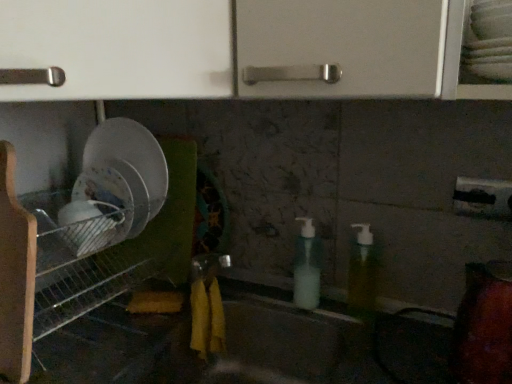
Question: Does translucent plastic soap dispenser at center, the second soap dispenser in the left-to-right sequence, have a smaller size compared to matte gray sink at center?

Choices:
 (A) yes
 (B) no

Answer: (A)

Question: Does translucent plastic soap dispenser at center, positioned as the first soap dispenser in right-to-left order, have a greater height compared to matte gray sink at center?

Choices:
 (A) yes
 (B) no

Answer: (B)

Question: From the image's perspective, is translucent plastic soap dispenser at center, positioned as the first soap dispenser in right-to-left order, located beneath matte gray sink at center?

Choices:
 (A) yes
 (B) no

Answer: (B)

Question: Is translucent plastic soap dispenser at center, positioned as the first soap dispenser in right-to-left order, touching matte gray sink at center?

Choices:
 (A) yes
 (B) no

Answer: (B)

Question: From a real-world perspective, is translucent plastic soap dispenser at center, the second soap dispenser in the left-to-right sequence, below matte gray sink at center?

Choices:
 (A) yes
 (B) no

Answer: (B)

Question: Does translucent plastic soap dispenser at center, positioned as the first soap dispenser in right-to-left order, appear on the left side of matte gray sink at center?

Choices:
 (A) yes
 (B) no

Answer: (B)

Question: Can you confirm if metallic wire rack at left is positioned to the left of translucent plastic soap dispenser at center, the second soap dispenser in the left-to-right sequence?

Choices:
 (A) yes
 (B) no

Answer: (A)

Question: Is metallic wire rack at left smaller than translucent plastic soap dispenser at center, the second soap dispenser in the left-to-right sequence?

Choices:
 (A) yes
 (B) no

Answer: (B)

Question: Is metallic wire rack at left oriented towards translucent plastic soap dispenser at center, positioned as the first soap dispenser in right-to-left order?

Choices:
 (A) no
 (B) yes

Answer: (A)

Question: Considering the relative sizes of metallic wire rack at left and translucent plastic soap dispenser at center, the second soap dispenser in the left-to-right sequence, in the image provided, is metallic wire rack at left wider than translucent plastic soap dispenser at center, the second soap dispenser in the left-to-right sequence,?

Choices:
 (A) yes
 (B) no

Answer: (A)

Question: From the image's perspective, would you say metallic wire rack at left is positioned over translucent plastic soap dispenser at center, positioned as the first soap dispenser in right-to-left order?

Choices:
 (A) no
 (B) yes

Answer: (A)

Question: Would you say metallic wire rack at left is a long distance from translucent plastic soap dispenser at center, the second soap dispenser in the left-to-right sequence?

Choices:
 (A) yes
 (B) no

Answer: (B)

Question: From a real-world perspective, is metallic wire rack at left located beneath translucent plastic soap dispenser at center, which appears as the second soap dispenser when viewed from the right?

Choices:
 (A) yes
 (B) no

Answer: (B)